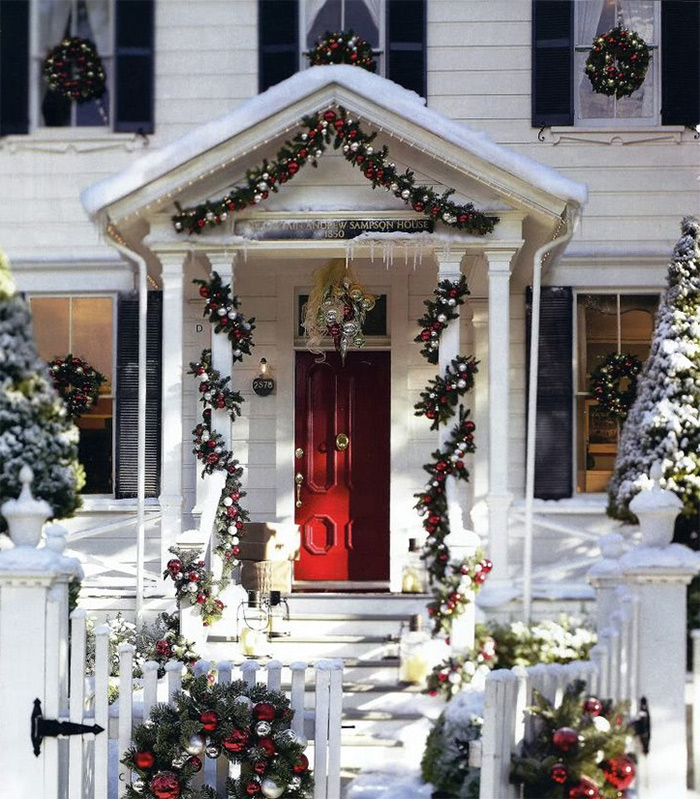
Locate an element on the screen. This screenshot has width=700, height=799. red door is located at coordinates (354, 510).